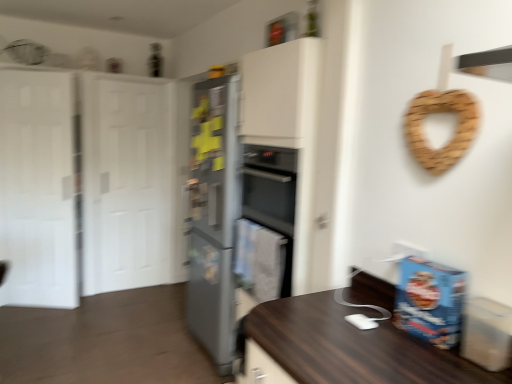
Question: Is satin silver refrigerator at center shorter than white glossy door at left, which ranks as the 2th glass door in front-to-back order?

Choices:
 (A) no
 (B) yes

Answer: (B)

Question: From the image's perspective, does satin silver refrigerator at center appear lower than white glossy door at left, the 2th glass door in the left-to-right sequence?

Choices:
 (A) yes
 (B) no

Answer: (A)

Question: Can you confirm if satin silver refrigerator at center is wider than white glossy door at left, the 2th glass door in the left-to-right sequence?

Choices:
 (A) no
 (B) yes

Answer: (B)

Question: Does satin silver refrigerator at center have a smaller size compared to white glossy door at left, which is the first glass door in right-to-left order?

Choices:
 (A) no
 (B) yes

Answer: (A)

Question: Is satin silver refrigerator at center surrounding white glossy door at left, which ranks as the 2th glass door in front-to-back order?

Choices:
 (A) yes
 (B) no

Answer: (B)

Question: From the image's perspective, is satin silver refrigerator at center above or below white glossy door at left, the 1th glass door in the left-to-right sequence?

Choices:
 (A) below
 (B) above

Answer: (A)

Question: Considering the positions of satin silver refrigerator at center and white glossy door at left, the 1th glass door in the left-to-right sequence, in the image, is satin silver refrigerator at center wider or thinner than white glossy door at left, the 1th glass door in the left-to-right sequence,?

Choices:
 (A) thin
 (B) wide

Answer: (B)

Question: Is satin silver refrigerator at center inside the boundaries of white glossy door at left, which ranks as the 2th glass door in back-to-front order, or outside?

Choices:
 (A) inside
 (B) outside

Answer: (B)

Question: From a real-world perspective, relative to white glossy door at left, the 1th glass door in the left-to-right sequence, is satin silver refrigerator at center vertically above or below?

Choices:
 (A) above
 (B) below

Answer: (B)

Question: Looking at their shapes, would you say white glossy door at left, which ranks as the 2th glass door in front-to-back order, is wider or thinner than white matte door at left?

Choices:
 (A) thin
 (B) wide

Answer: (A)

Question: In terms of size, does white glossy door at left, the 2th glass door in the left-to-right sequence, appear bigger or smaller than white matte door at left?

Choices:
 (A) small
 (B) big

Answer: (A)

Question: Considering the positions of point (87, 187) and point (26, 183), is point (87, 187) closer or farther from the camera than point (26, 183)?

Choices:
 (A) closer
 (B) farther

Answer: (B)

Question: In terms of height, does white glossy door at left, which is the first glass door in right-to-left order, look taller or shorter compared to white matte door at left?

Choices:
 (A) short
 (B) tall

Answer: (A)

Question: Is white glossy door at left, which is the first glass door in right-to-left order, situated inside satin silver refrigerator at center or outside?

Choices:
 (A) outside
 (B) inside

Answer: (A)

Question: Is point (162, 150) closer or farther from the camera than point (218, 317)?

Choices:
 (A) closer
 (B) farther

Answer: (B)